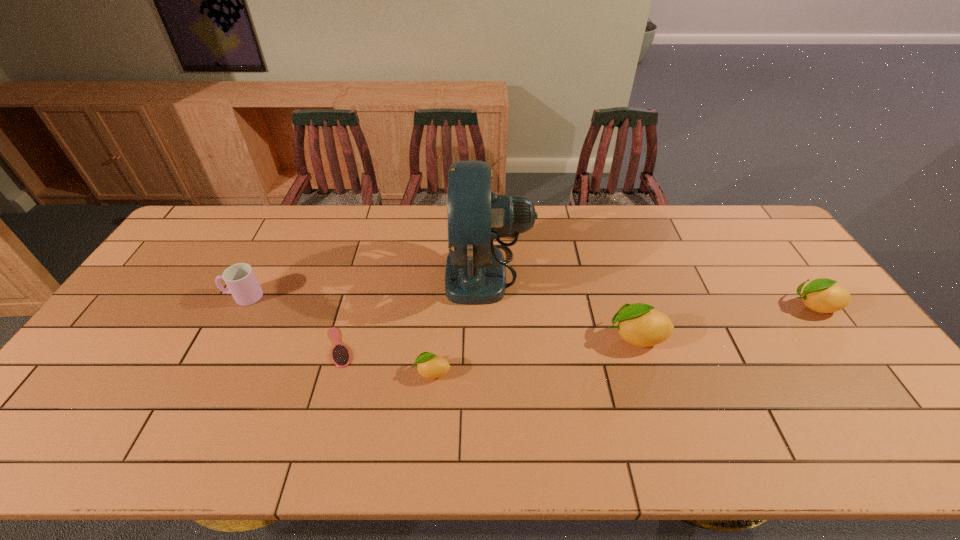
Identify the location of free area in between the fan and the shortest object. This screenshot has height=540, width=960. (414, 309).

At what (x,y) coordinates should I click in order to perform the action: click on blank region between the cup and the shortest object. Please return your answer as a coordinate pair (x, y). This screenshot has height=540, width=960. Looking at the image, I should click on (292, 322).

At what (x,y) coordinates should I click in order to perform the action: click on free spot between the leftmost object and the second object from left to right. Please return your answer as a coordinate pair (x, y). Looking at the image, I should click on (292, 322).

What are the coordinates of `empty space between the rightmost object and the second object from right to left` in the screenshot? It's located at (725, 321).

Identify the location of vacant point located between the cup and the rightmost object. (529, 301).

The height and width of the screenshot is (540, 960). Find the location of `object that stands as the second closest to the leftmost lemon`. object that stands as the second closest to the leftmost lemon is located at coordinates pos(341,357).

The width and height of the screenshot is (960, 540). In order to click on object identified as the second closest to the second shortest lemon in this screenshot , I will do `click(475, 274)`.

Point out which lemon is positioned as the nearest to the second lemon from right to left. Please provide its 2D coordinates. Your answer should be formatted as a tuple, i.e. [(x, y)], where the tuple contains the x and y coordinates of a point satisfying the conditions above.

[(822, 295)]

Where is `lemon that is the closest to the fifth object from right to left`? The width and height of the screenshot is (960, 540). lemon that is the closest to the fifth object from right to left is located at coordinates (431, 366).